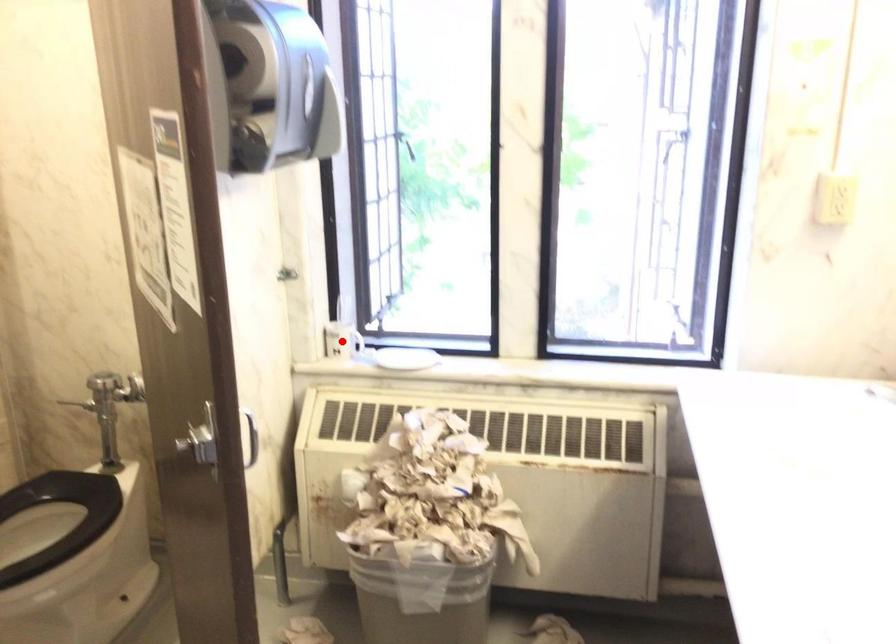
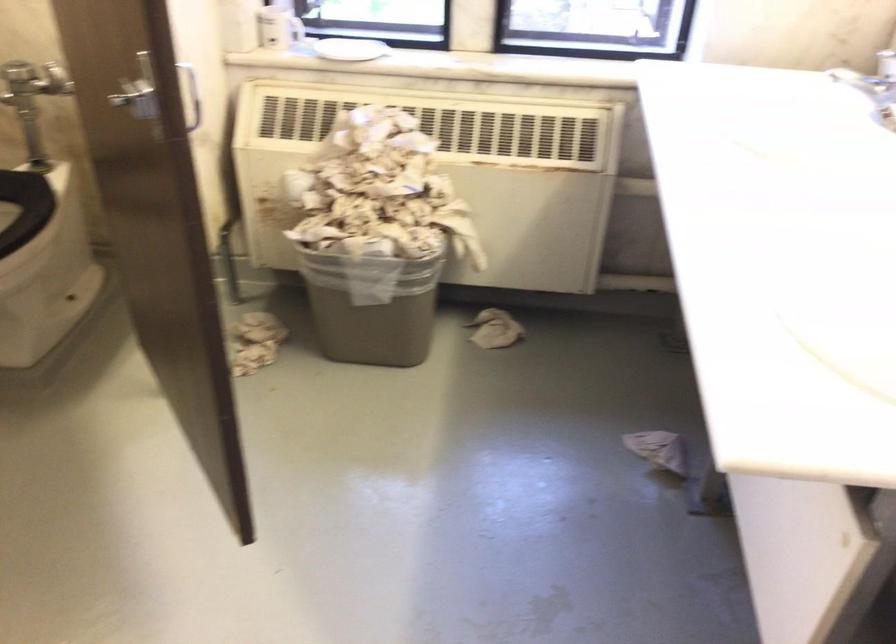
Question: I am providing you with two images of the same scene from different viewpoints. A red point is shown in image1. For the corresponding object point in image2, is it positioned nearer or farther from the camera?

Choices:
 (A) Nearer
 (B) Farther

Answer: (A)